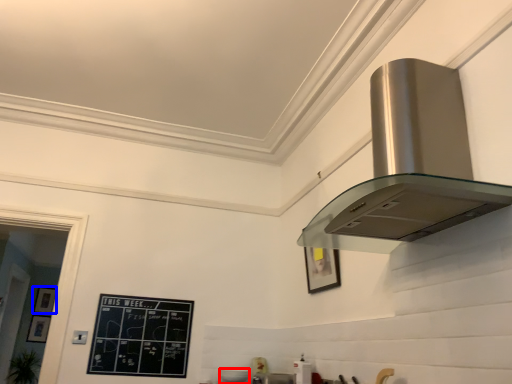
Question: Which point is closer to the camera, appliance (highlighted by a red box) or picture frame (highlighted by a blue box)?

Choices:
 (A) appliance
 (B) picture frame

Answer: (A)